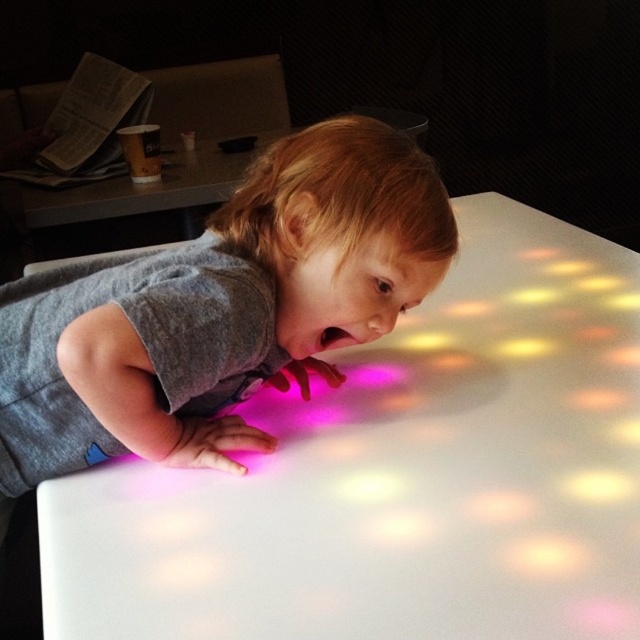
Who is more forward, (472,339) or (378,257)?

Point (378,257)

Is point (419, 612) positioned in front of point (172, 387)?

That is True.

This screenshot has height=640, width=640. What are the coordinates of `white glossy table at center` in the screenshot? It's located at (400, 476).

The image size is (640, 640). In order to click on white glossy table at center in this screenshot , I will do `click(400, 476)`.